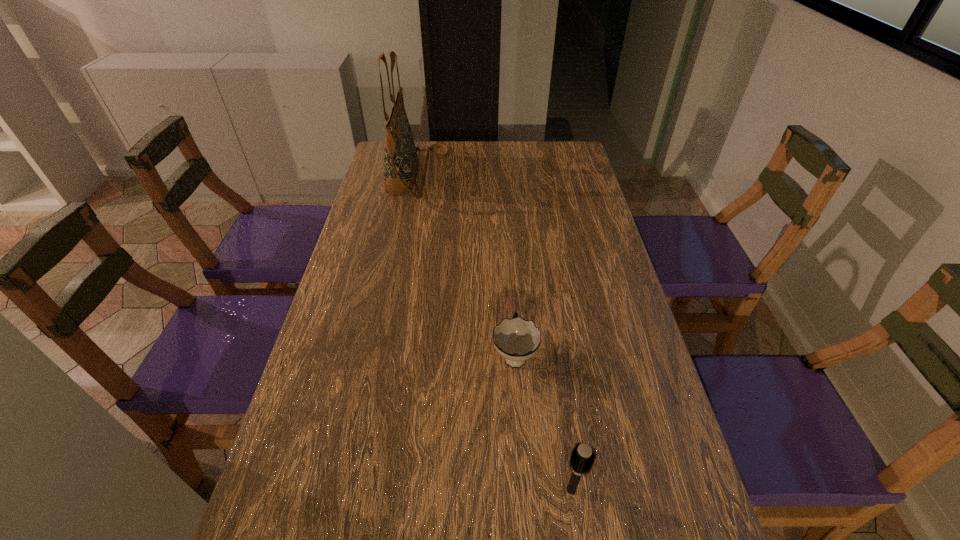
At what (x,y) coordinates should I click in order to perform the action: click on vacant space situated 0.070m on the side of the second object from right to left with the handle. Please return your answer as a coordinate pair (x, y). Image resolution: width=960 pixels, height=540 pixels. Looking at the image, I should click on (512, 310).

Locate an element on the screen. object at the far edge is located at coordinates coord(401,162).

I want to click on object that is at the left edge, so click(x=401, y=162).

At what (x,y) coordinates should I click in order to perform the action: click on object present at the far left corner. Please return your answer as a coordinate pair (x, y). The image size is (960, 540). Looking at the image, I should click on [x=401, y=162].

In order to click on vacant space at the far edge of the desktop in this screenshot , I will do `click(506, 140)`.

Image resolution: width=960 pixels, height=540 pixels. In the image, there is a desktop. What are the coordinates of `blank space at the left edge` in the screenshot? It's located at (381, 276).

Image resolution: width=960 pixels, height=540 pixels. In the image, there is a desktop. Identify the location of vacant space at the right edge. (642, 362).

Locate an element on the screen. free space between the second object from left to right and the tallest object is located at coordinates (466, 264).

You are a GUI agent. You are given a task and a screenshot of the screen. Output one action in this format:
    pyautogui.click(x=<x>, y=<y>)
    Task: Click on the free space between the shortest object and the leftmost object
    The width and height of the screenshot is (960, 540).
    Given the screenshot: What is the action you would take?
    pyautogui.click(x=466, y=264)

Identify the location of free point between the second object from left to right and the second tallest object. The image size is (960, 540). (543, 422).